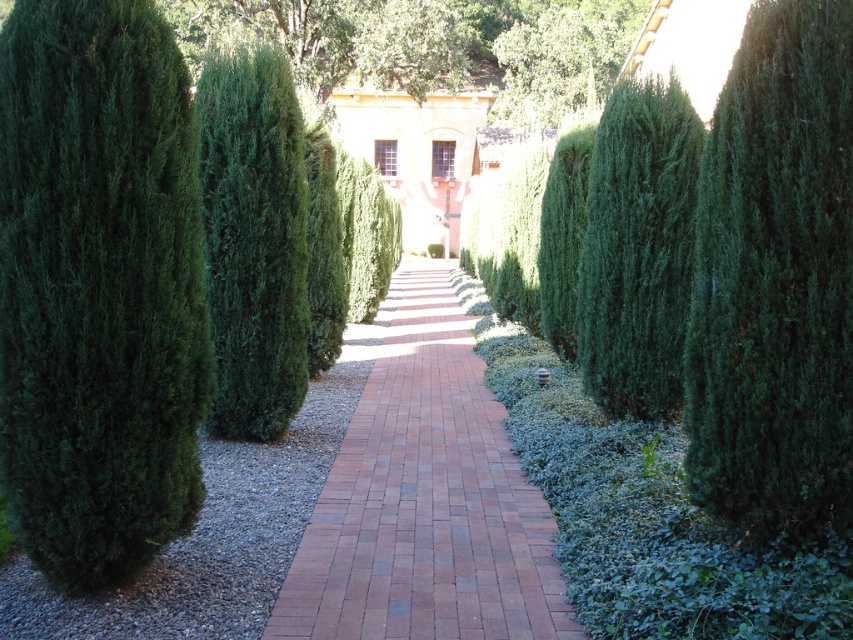
Question: Among these objects, which one is farthest from the camera?

Choices:
 (A) brick at center
 (B) green leafy tree at center

Answer: (B)

Question: Is green dense shrub at left below green leafy tree at center?

Choices:
 (A) yes
 (B) no

Answer: (A)

Question: In this image, where is brick at center located relative to green leafy tree at center?

Choices:
 (A) right
 (B) left

Answer: (B)

Question: Estimate the real-world distances between objects in this image. Which object is closer to the brick at center?

Choices:
 (A) green leafy tree at center
 (B) green dense shrub at left

Answer: (B)

Question: Does green dense shrub at left have a greater width compared to green leafy tree at center?

Choices:
 (A) yes
 (B) no

Answer: (B)

Question: Based on their relative distances, which object is farther from the green dense shrub at left?

Choices:
 (A) green leafy tree at center
 (B) brick at center

Answer: (A)